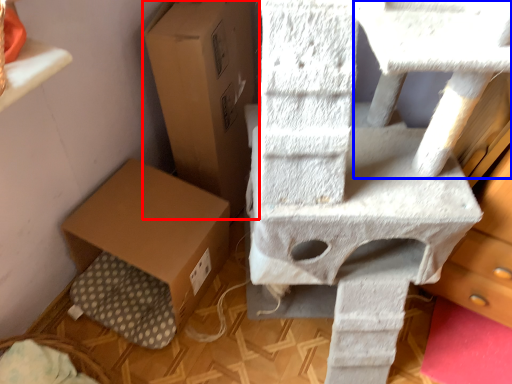
Question: Which of the following is the farthest to the observer, cardboard box (highlighted by a red box) or table (highlighted by a blue box)?

Choices:
 (A) cardboard box
 (B) table

Answer: (A)